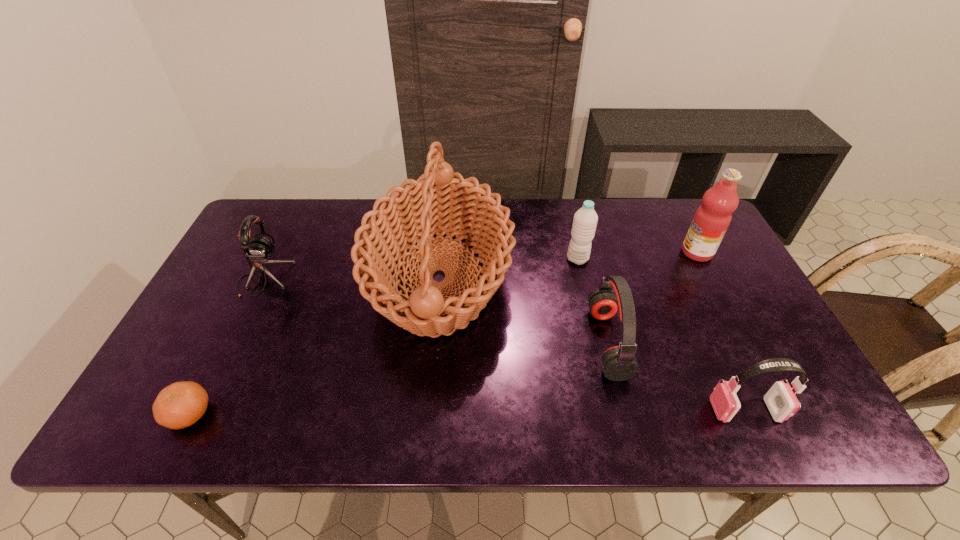
At what (x,y) coordinates should I click in order to perform the action: click on object at the far right corner. Please return your answer as a coordinate pair (x, y). This screenshot has width=960, height=540. Looking at the image, I should click on (712, 219).

What are the coordinates of `object present at the near right corner` in the screenshot? It's located at (782, 403).

Locate an element on the screen. free space at the far edge of the desktop is located at coordinates click(553, 224).

The width and height of the screenshot is (960, 540). In the image, there is a desktop. Identify the location of vacant space at the near edge. (293, 410).

Where is `vacant space at the left edge of the desktop`? The height and width of the screenshot is (540, 960). vacant space at the left edge of the desktop is located at coordinates (183, 356).

The image size is (960, 540). In the image, there is a desktop. Find the location of `vacant space at the far left corner`. vacant space at the far left corner is located at coordinates (287, 211).

At what (x,y) coordinates should I click in order to perform the action: click on free region at the far right corner of the desktop. Please return your answer as a coordinate pair (x, y). The image size is (960, 540). Looking at the image, I should click on (659, 199).

Locate an element on the screen. The height and width of the screenshot is (540, 960). unoccupied position between the basket and the water bottle is located at coordinates (509, 269).

At what (x,y) coordinates should I click in order to perform the action: click on empty location between the rightmost earphone and the water bottle. Please return your answer as a coordinate pair (x, y). The height and width of the screenshot is (540, 960). Looking at the image, I should click on (661, 335).

The width and height of the screenshot is (960, 540). I want to click on vacant space that is in between the water bottle and the tallest object, so [509, 269].